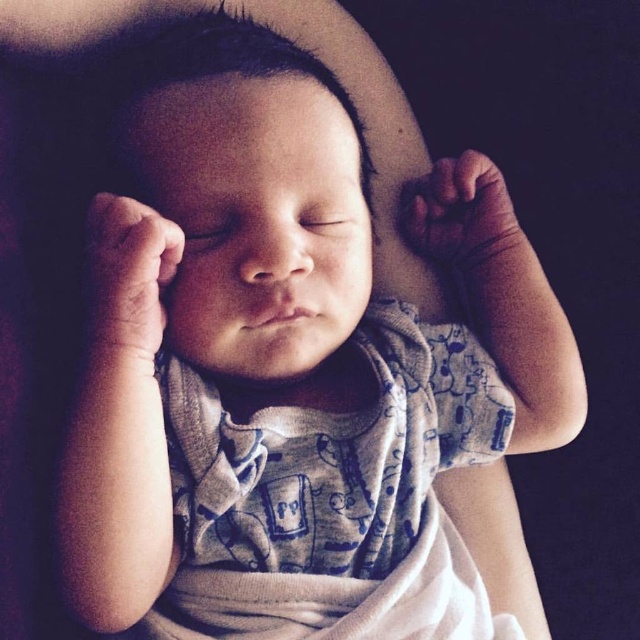
What are the coordinates of `smooth skin hand at center` in the screenshot? It's located at (129, 275).

Which of these two, smooth skin hand at center or smooth skin hand at upper center, stands taller?

smooth skin hand at center

The image size is (640, 640). What do you see at coordinates (129, 275) in the screenshot? I see `smooth skin hand at center` at bounding box center [129, 275].

At what (x,y) coordinates should I click in order to perform the action: click on smooth skin hand at center. Please return your answer as a coordinate pair (x, y). This screenshot has width=640, height=640. Looking at the image, I should click on (129, 275).